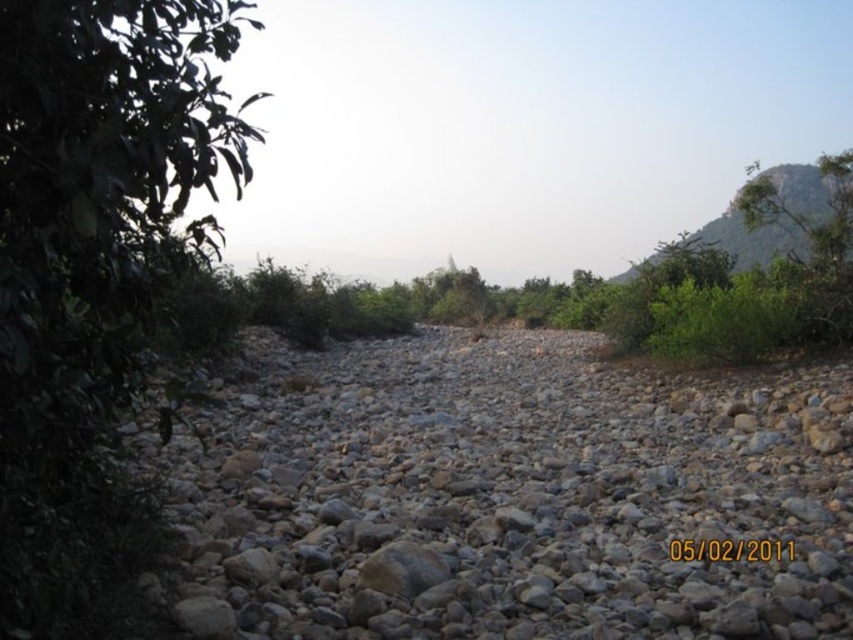
Who is positioned more to the left, gray rough gravel at center or green leafy tree at left?

green leafy tree at left

Who is higher up, gray rough gravel at center or green leafy tree at left?

green leafy tree at left

Is point (798, 452) positioned before point (15, 541)?

No, (798, 452) is further to viewer.

Identify the location of gray rough gravel at center. The width and height of the screenshot is (853, 640). (509, 496).

Does gray rough gravel at center have a larger size compared to green leafy tree at upper right?

Incorrect, gray rough gravel at center is not larger than green leafy tree at upper right.

Which is more to the right, gray rough gravel at center or green leafy tree at upper right?

green leafy tree at upper right

Between point (236, 513) and point (753, 202), which one is positioned behind?

Point (753, 202)

Locate an element on the screen. The width and height of the screenshot is (853, 640). gray rough gravel at center is located at coordinates (509, 496).

Can you confirm if green leafy tree at left is wider than green leafy tree at upper right?

In fact, green leafy tree at left might be narrower than green leafy tree at upper right.

Does green leafy tree at left have a greater height compared to green leafy tree at upper right?

Yes.

Find the location of `green leafy tree at left`. green leafy tree at left is located at coordinates (93, 262).

Where is `green leafy tree at left`? green leafy tree at left is located at coordinates (93, 262).